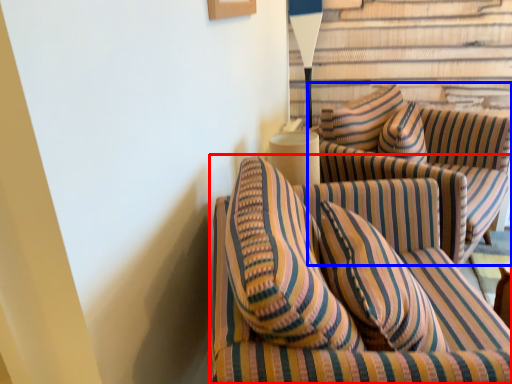
Question: Which object appears closest to the camera in this image, studio couch (highlighted by a red box) or studio couch (highlighted by a blue box)?

Choices:
 (A) studio couch
 (B) studio couch

Answer: (A)